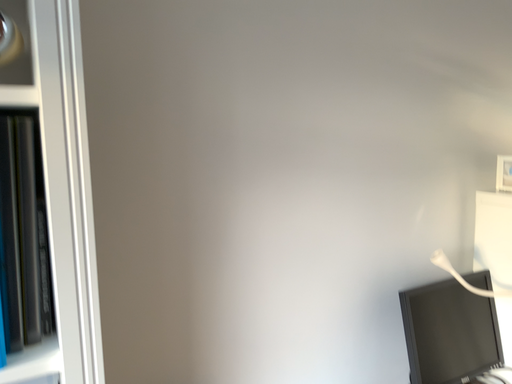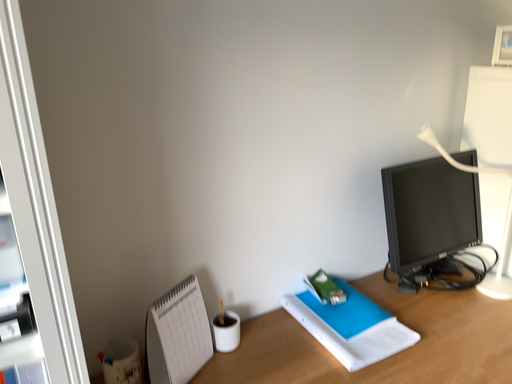
Question: Which way did the camera rotate in the video?

Choices:
 (A) rotated downward
 (B) rotated upward

Answer: (A)